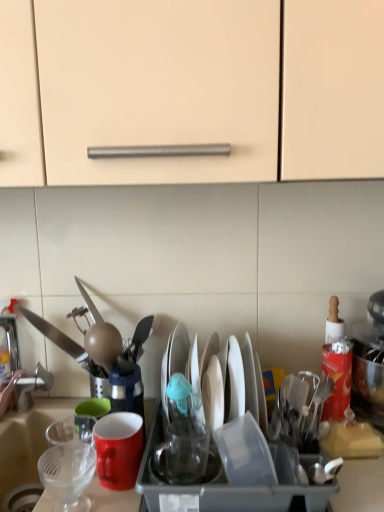
Question: Considering the relative sizes of matte red mug at center and clear plastic strainer at lower left, which is counted as the 1th tableware, starting from the left, in the image provided, is matte red mug at center smaller than clear plastic strainer at lower left, which is counted as the 1th tableware, starting from the left,?

Choices:
 (A) yes
 (B) no

Answer: (B)

Question: Considering the relative positions of matte red mug at center and clear plastic strainer at lower left, which is counted as the 1th tableware, starting from the left, in the image provided, is matte red mug at center behind clear plastic strainer at lower left, which is counted as the 1th tableware, starting from the left,?

Choices:
 (A) no
 (B) yes

Answer: (B)

Question: Is matte red mug at center thinner than clear plastic strainer at lower left, acting as the second tableware starting from the right?

Choices:
 (A) no
 (B) yes

Answer: (A)

Question: Is matte red mug at center turned away from clear plastic strainer at lower left, which is counted as the 1th tableware, starting from the left?

Choices:
 (A) yes
 (B) no

Answer: (B)

Question: Considering the relative sizes of matte red mug at center and clear plastic strainer at lower left, which is counted as the 1th tableware, starting from the left, in the image provided, is matte red mug at center wider than clear plastic strainer at lower left, which is counted as the 1th tableware, starting from the left,?

Choices:
 (A) no
 (B) yes

Answer: (B)

Question: Is matte red mug at center spatially inside clear plastic strainer at lower left, which is counted as the 1th tableware, starting from the left, or outside of it?

Choices:
 (A) inside
 (B) outside

Answer: (B)

Question: From a real-world perspective, is matte red mug at center positioned above or below clear plastic strainer at lower left, which is counted as the 1th tableware, starting from the left?

Choices:
 (A) below
 (B) above

Answer: (B)

Question: Does point (129, 413) appear closer or farther from the camera than point (66, 465)?

Choices:
 (A) farther
 (B) closer

Answer: (A)

Question: Considering their positions, is matte red mug at center located in front of or behind clear plastic strainer at lower left, acting as the second tableware starting from the right?

Choices:
 (A) behind
 (B) front

Answer: (A)

Question: In terms of width, does transparent plastic cup at center, which appears as the first tableware when viewed from the right, look wider or thinner when compared to white paper at right?

Choices:
 (A) thin
 (B) wide

Answer: (B)

Question: From the image's perspective, is transparent plastic cup at center, which appears as the first tableware when viewed from the right, above or below white paper at right?

Choices:
 (A) below
 (B) above

Answer: (A)

Question: Is transparent plastic cup at center, which appears as the first tableware when viewed from the right, bigger or smaller than white paper at right?

Choices:
 (A) small
 (B) big

Answer: (A)

Question: Is point (178, 467) positioned closer to the camera than point (322, 352)?

Choices:
 (A) closer
 (B) farther

Answer: (A)

Question: Is matte red mug at center situated inside transparent plastic cup at center, which appears as the first tableware when viewed from the right, or outside?

Choices:
 (A) outside
 (B) inside

Answer: (A)

Question: Considering the positions of matte red mug at center and transparent plastic cup at center, acting as the 2th tableware starting from the left, in the image, is matte red mug at center wider or thinner than transparent plastic cup at center, acting as the 2th tableware starting from the left,?

Choices:
 (A) wide
 (B) thin

Answer: (A)